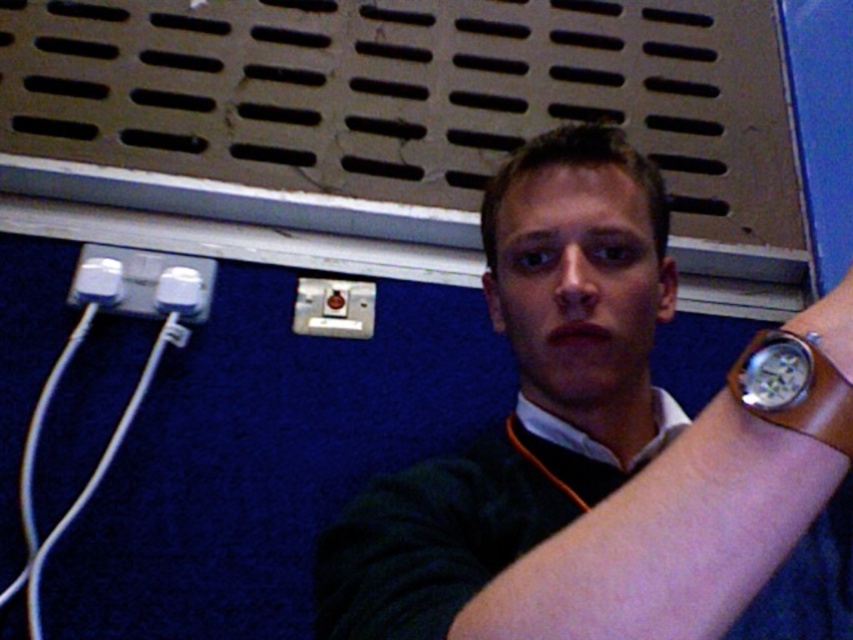
You are holding a remote control that is 4 feet long. You want to place it between the white plastic plug at left and the brown perforated panel above the blue wall. Can you fit the remote control horizontally between them?

The distance between the white plastic plug at left and the brown perforated panel above the blue wall is 3.90 feet, which is slightly shorter than the remote control. Therefore, the remote control cannot be placed horizontally between them as it would not fit.

You are a photographer adjusting the lighting in the room. You notice the brown leather watch at upper right and the white plastic plug at left. Which object is closer to the camera lens?

The brown leather watch at upper right is closer to the camera lens because it is in front of the white plastic plug at left.

You are setting up a photo shoot and need to adjust the lighting. You notice the brown leather watch at upper right and the white plastic plug at left in the frame. Which object is positioned lower in the image?

The brown leather watch at upper right is located below the white plastic plug at left, so it is positioned lower in the image.